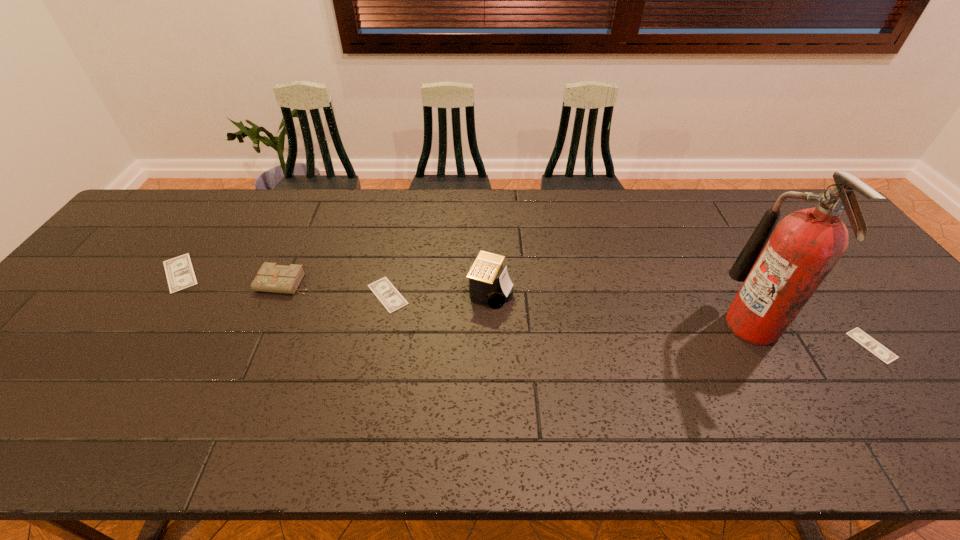
To make them evenly spaced by inserting another money among them, please locate a vacant spot for this new money. Please provide its 2D coordinates. Your answer should be formatted as a tuple, i.e. [(x, y)], where the tuple contains the x and y coordinates of a point satisfying the conditions above.

[(617, 319)]